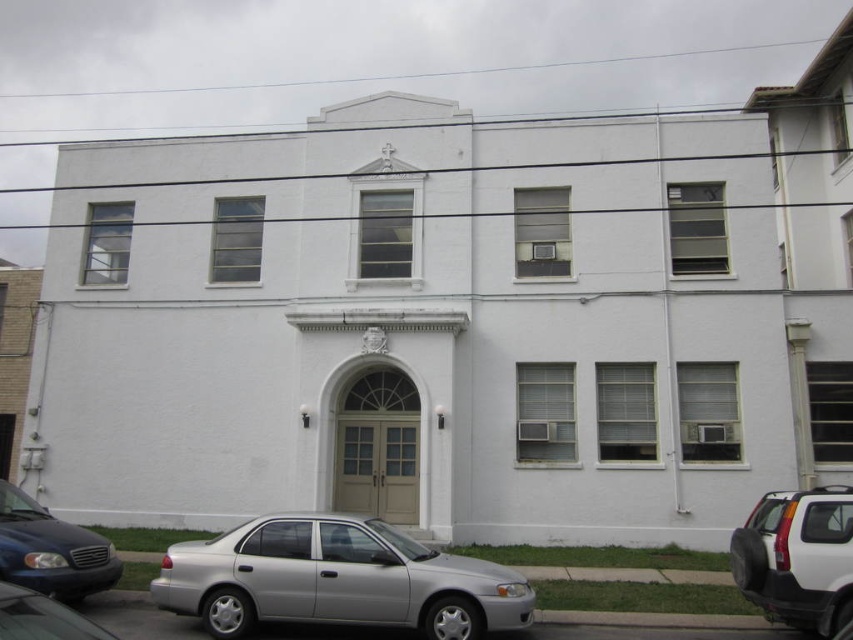
Can you confirm if matte black sedan at lower left is shorter than shiny black sedan at lower left?

No.

Does matte black sedan at lower left have a larger size compared to shiny black sedan at lower left?

Yes, matte black sedan at lower left is bigger than shiny black sedan at lower left.

Is point (39, 532) farther from camera compared to point (96, 637)?

Yes, point (39, 532) is behind point (96, 637).

Locate an element on the screen. The width and height of the screenshot is (853, 640). matte black sedan at lower left is located at coordinates (51, 550).

Who is more distant from viewer, (358, 566) or (4, 556)?

Positioned behind is point (4, 556).

This screenshot has width=853, height=640. Find the location of `silver metallic sedan at center`. silver metallic sedan at center is located at coordinates (335, 579).

The height and width of the screenshot is (640, 853). Find the location of `silver metallic sedan at center`. silver metallic sedan at center is located at coordinates (335, 579).

Is white matte suv at right smaller than matte black sedan at lower left?

Correct, white matte suv at right occupies less space than matte black sedan at lower left.

Is white matte suv at right taller than matte black sedan at lower left?

Yes.

Image resolution: width=853 pixels, height=640 pixels. What are the coordinates of `white matte suv at right` in the screenshot? It's located at (798, 557).